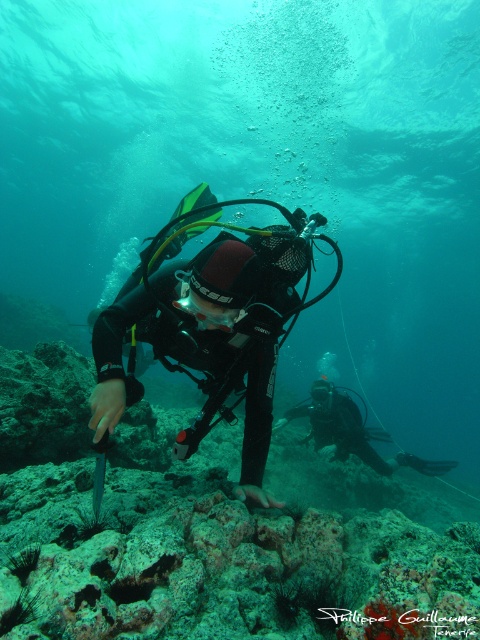
Which of these two, rough textured coral reef at center or clear plastic goggles at center, stands taller?

Standing taller between the two is rough textured coral reef at center.

Is rough textured coral reef at center shorter than clear plastic goggles at center?

In fact, rough textured coral reef at center may be taller than clear plastic goggles at center.

Which is behind, point (350, 572) or point (213, 328)?

The point (213, 328) is more distant.

Where is `rough textured coral reef at center`? The image size is (480, 640). rough textured coral reef at center is located at coordinates (204, 532).

Which is behind, point (110, 484) or point (250, 248)?

Point (110, 484)

Is point (297, 628) positioned before point (227, 288)?

Yes, it is in front of point (227, 288).

Identify the location of rough textured coral reef at center. [x=204, y=532].

Is point (131, 378) less distant than point (216, 310)?

No.

Is black matte scuba diver at center thinner than clear plastic goggles at center?

Incorrect, black matte scuba diver at center's width is not less than clear plastic goggles at center's.

Is point (299, 296) positioned after point (228, 310)?

Yes, point (299, 296) is behind point (228, 310).

Locate an element on the screen. black matte scuba diver at center is located at coordinates (204, 332).